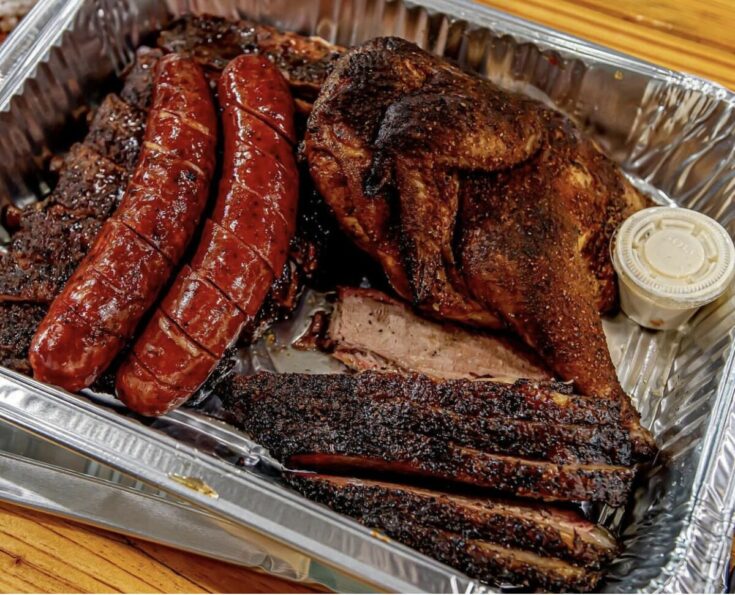
At what (x,y) coordinates should I click in order to perform the action: click on wooden table. Please return your answer as a coordinate pair (x, y). Image resolution: width=735 pixels, height=595 pixels. Looking at the image, I should click on (700, 43), (70, 560).